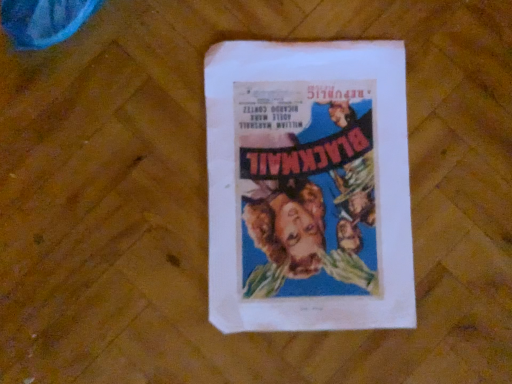
This screenshot has height=384, width=512. Describe the element at coordinates (308, 186) in the screenshot. I see `matte paper poster at center` at that location.

This screenshot has height=384, width=512. Find the location of `matte paper poster at center`. matte paper poster at center is located at coordinates (308, 186).

Where is `matte paper poster at center`? The height and width of the screenshot is (384, 512). matte paper poster at center is located at coordinates (308, 186).